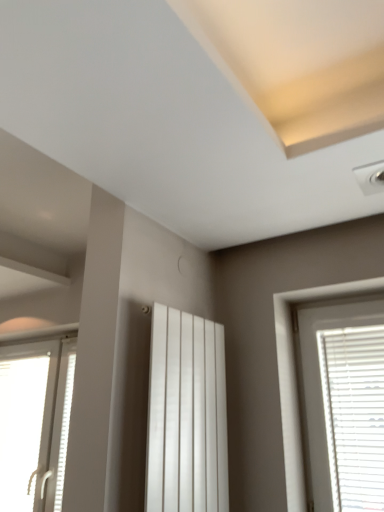
You are a GUI agent. You are given a task and a screenshot of the screen. Output one action in this format:
    pyautogui.click(x=<x>, y=<y>)
    Task: Click on the white plastic window at left
    The width and height of the screenshot is (384, 512).
    Given the screenshot: What is the action you would take?
    pyautogui.click(x=35, y=423)

Describe the element at coordinates (35, 423) in the screenshot. I see `white plastic window at left` at that location.

Find the location of a particular element. The width and height of the screenshot is (384, 512). white plastic window at left is located at coordinates (35, 423).